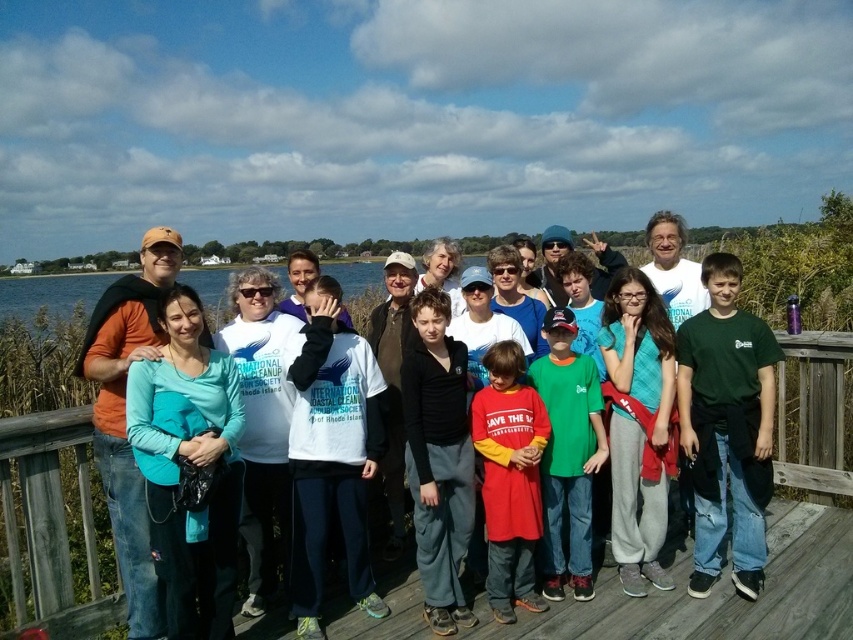
Can you confirm if green matte shirt at center-right is positioned to the left of matte orange shirt at left?

No, green matte shirt at center-right is not to the left of matte orange shirt at left.

Between point (764, 326) and point (115, 497), which one is positioned in front?

Point (115, 497) is more forward.

You are a GUI agent. You are given a task and a screenshot of the screen. Output one action in this format:
    pyautogui.click(x=<x>, y=<y>)
    Task: Click on the green matte shirt at center-right
    The height and width of the screenshot is (640, 853).
    Given the screenshot: What is the action you would take?
    pyautogui.click(x=726, y=426)

Is green matte shirt at center-right taller than green cotton shirt at center?

Yes.

Between point (708, 499) and point (582, 550), which one is positioned in front?

Point (708, 499) is more forward.

Measure the distance between point (708,545) and camera.

A distance of 4.28 meters exists between point (708,545) and camera.

Where is `green matte shirt at center-right`? green matte shirt at center-right is located at coordinates (726, 426).

Between matte white t-shirt at center and white cotton shirt at center, which one has less height?

Standing shorter between the two is white cotton shirt at center.

Between point (112, 358) and point (316, 355), which one is positioned behind?

Positioned behind is point (316, 355).

Identify the location of matte white t-shirt at center. The width and height of the screenshot is (853, 640). (670, 262).